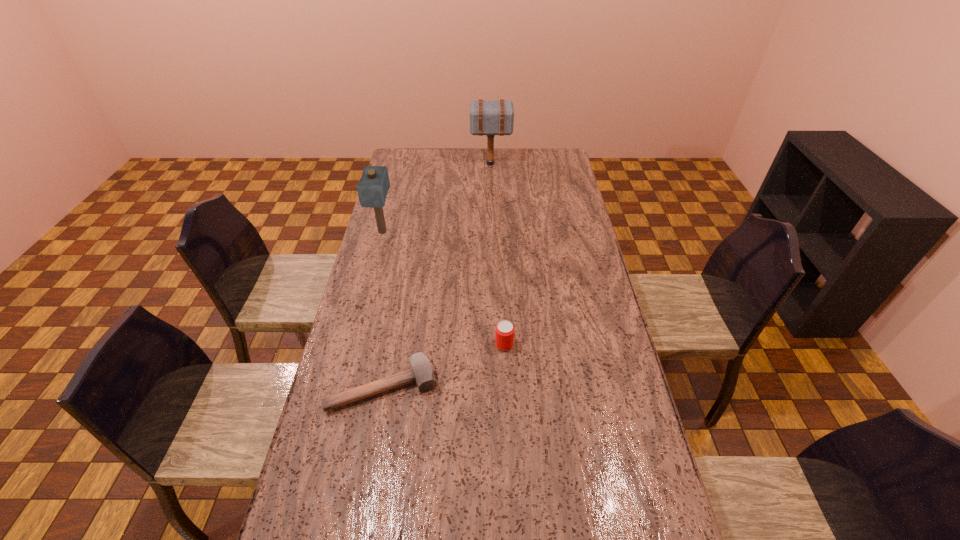
At what (x,y) coordinates should I click in order to perform the action: click on the farthest mallet. Please return your answer as a coordinate pair (x, y). Looking at the image, I should click on (487, 117).

Identify the location of the farthest object. (487, 117).

The height and width of the screenshot is (540, 960). Find the location of `the second nearest mallet`. the second nearest mallet is located at coordinates (372, 189).

The image size is (960, 540). Identify the location of the second nearest object. (504, 335).

This screenshot has height=540, width=960. I want to click on the third tallest object, so click(504, 335).

You are a GUI agent. You are given a task and a screenshot of the screen. Output one action in this format:
    pyautogui.click(x=<x>, y=<y>)
    Task: Click on the shortest object
    
    Given the screenshot: What is the action you would take?
    pyautogui.click(x=422, y=371)

Locate an element on the screen. the nearest object is located at coordinates (422, 371).

Locate an element on the screen. The height and width of the screenshot is (540, 960). free space located 0.320m on the striking surface of the rightmost mallet is located at coordinates (406, 164).

This screenshot has width=960, height=540. I want to click on blank area located on the striking surface of the rightmost mallet, so click(450, 164).

This screenshot has width=960, height=540. In order to click on vacant space situated on the striking surface of the rightmost mallet in this screenshot , I will do `click(448, 164)`.